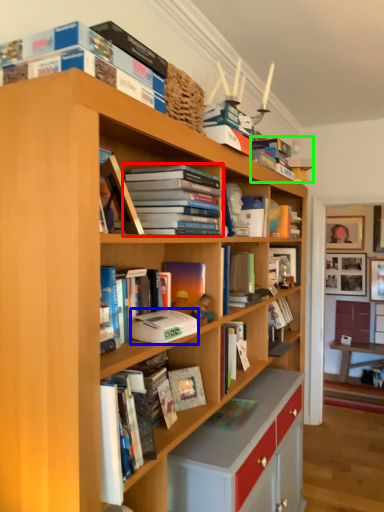
Question: Estimate the real-world distances between objects in this image. Which object is closer to book (highlighted by a red box), paperback book (highlighted by a blue box) or book (highlighted by a green box)?

Choices:
 (A) paperback book
 (B) book

Answer: (A)